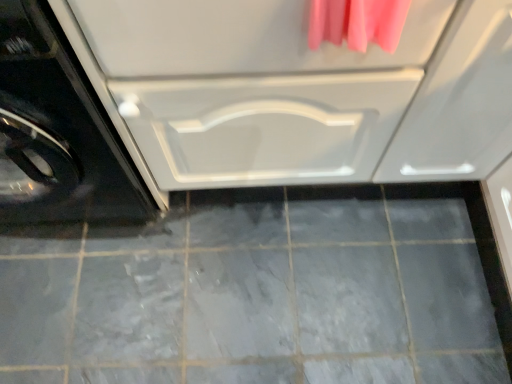
Question: Is point (39, 210) closer or farther from the camera than point (141, 124)?

Choices:
 (A) closer
 (B) farther

Answer: (B)

Question: Is black glossy washing machine at left bigger or smaller than white glossy drawer at center?

Choices:
 (A) big
 (B) small

Answer: (B)

Question: Considering the real-world distances, which object is farthest from the gray matte tile at center?

Choices:
 (A) black glossy washing machine at left
 (B) white glossy drawer at center

Answer: (B)

Question: Which of these objects is positioned closest to the gray matte tile at center?

Choices:
 (A) white glossy drawer at center
 (B) black glossy washing machine at left

Answer: (B)